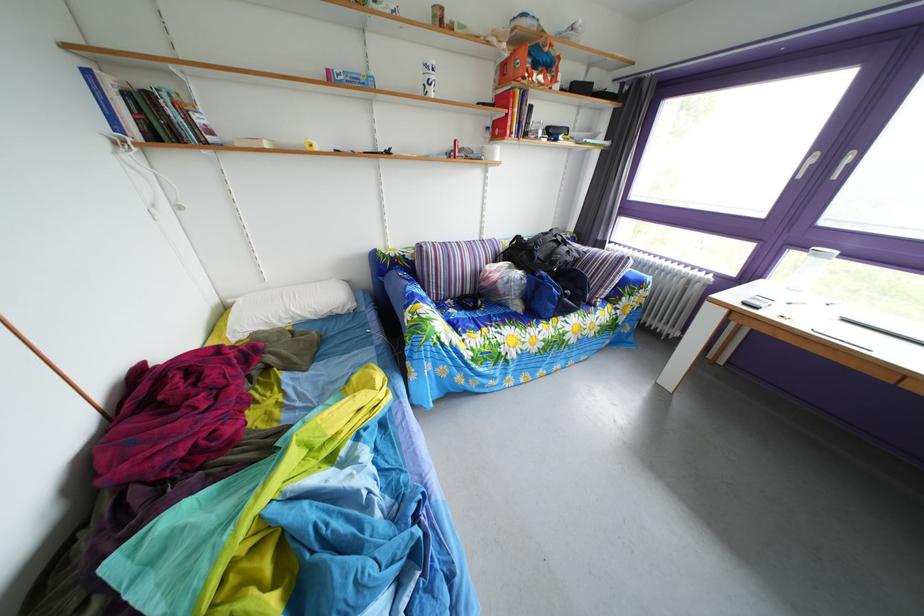
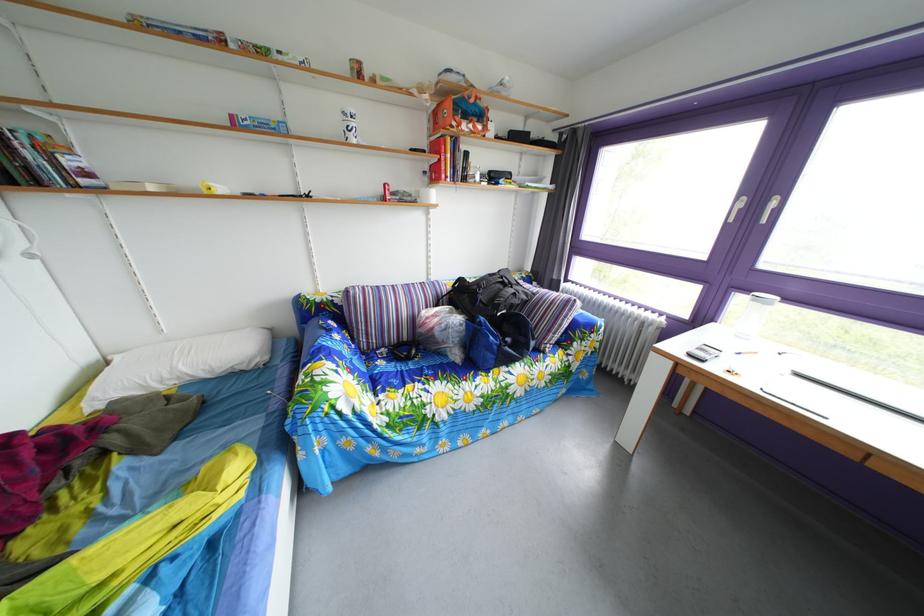
Question: How did the camera likely rotate?

Choices:
 (A) Left
 (B) Right
 (C) Up
 (D) Down

Answer: (C)